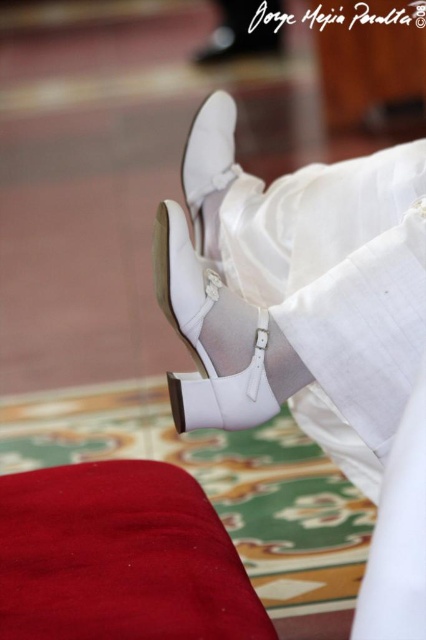
Question: Which object is the closest to the white leather shoes at center?

Choices:
 (A) white leather shoe at center
 (B) red velvet mat at lower left

Answer: (A)

Question: Which point is farther to the camera?

Choices:
 (A) (187, 180)
 (B) (166, 204)
 (C) (250, 621)
 (D) (209, 304)

Answer: (A)

Question: Is white leather sandal at center smaller than white leather shoe at center?

Choices:
 (A) no
 (B) yes

Answer: (A)

Question: In this image, where is white leather shoes at center located relative to white leather sandal at center?

Choices:
 (A) right
 (B) left

Answer: (A)

Question: Which of these objects is positioned farthest from the white leather sandal at center?

Choices:
 (A) white leather shoes at center
 (B) red velvet mat at lower left
 (C) white leather shoe at center

Answer: (C)

Question: Where is red velvet mat at lower left located in relation to white leather sandal at center in the image?

Choices:
 (A) below
 (B) above

Answer: (A)